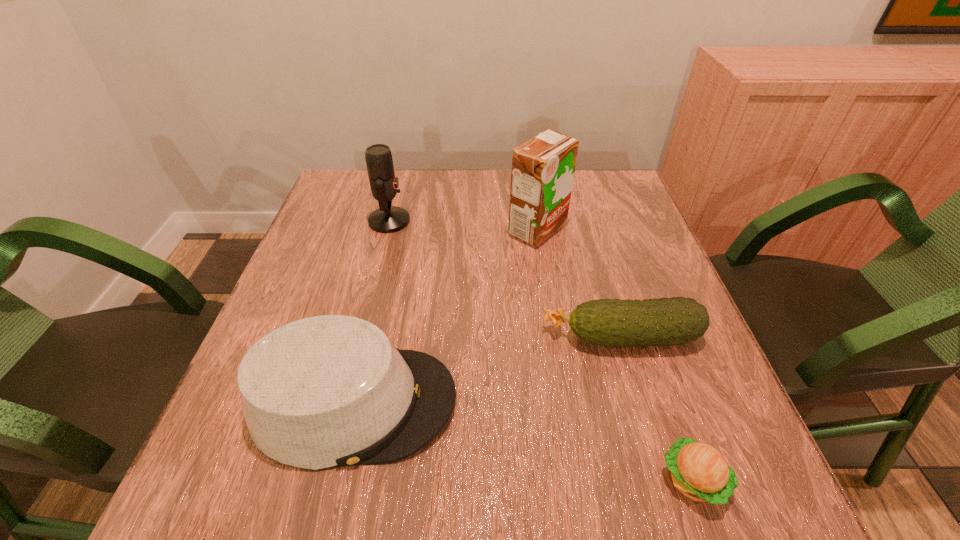
The height and width of the screenshot is (540, 960). I want to click on carton, so click(x=543, y=168).

Locate an element on the screen. the fourth shortest object is located at coordinates (387, 219).

You are a GUI agent. You are given a task and a screenshot of the screen. Output one action in this format:
    pyautogui.click(x=<x>, y=<y>)
    Task: Click on the hat
    This screenshot has width=960, height=540.
    Given the screenshot: What is the action you would take?
    pyautogui.click(x=327, y=391)

You are a GUI agent. You are given a task and a screenshot of the screen. Output one action in this format:
    pyautogui.click(x=<x>, y=<y>)
    Task: Click on the cucumber
    The width and height of the screenshot is (960, 540).
    Given the screenshot: What is the action you would take?
    pyautogui.click(x=667, y=321)

Where is `hamburger`? This screenshot has width=960, height=540. hamburger is located at coordinates (699, 471).

You are a GUI agent. You are given a task and a screenshot of the screen. Output one action in this format:
    pyautogui.click(x=<x>, y=<y>)
    Task: Click on the vacant area situated 0.300m on the straw side of the carton
    
    Given the screenshot: What is the action you would take?
    pyautogui.click(x=390, y=230)

This screenshot has height=540, width=960. What are the coordinates of `free location located on the straw side of the carton` in the screenshot? It's located at (370, 230).

The width and height of the screenshot is (960, 540). Find the location of `free space located 0.090m on the straw side of the carton`. free space located 0.090m on the straw side of the carton is located at coordinates (472, 230).

This screenshot has width=960, height=540. What are the coordinates of `vacant space located 0.320m on the side of the microphone with the red ring` in the screenshot? It's located at (533, 221).

Find the location of a particular element. This screenshot has width=960, height=540. free space located on the front-facing side of the third tallest object is located at coordinates (538, 402).